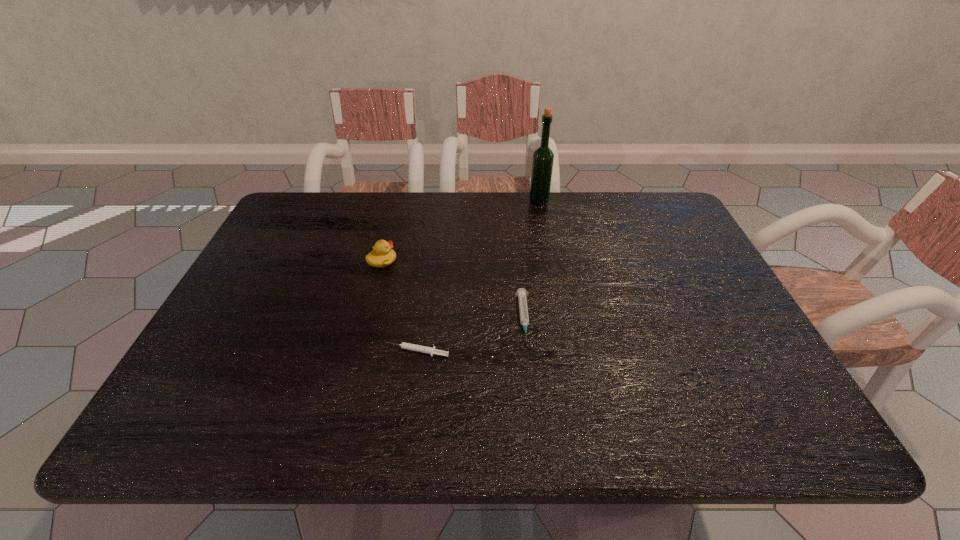
I want to click on the closest object relative to the shortest object, so tap(521, 293).

This screenshot has height=540, width=960. Find the location of `free space that satisfies the following two spatial constraints: 1. on the front side of the tallest object; 2. on the beak of the third nearest object`. free space that satisfies the following two spatial constraints: 1. on the front side of the tallest object; 2. on the beak of the third nearest object is located at coordinates (550, 261).

This screenshot has height=540, width=960. In order to click on free space that satisfies the following two spatial constraints: 1. on the beak of the shorter syringe; 2. on the left side of the third shortest object in this screenshot , I will do `click(359, 352)`.

Identify the location of free space that satisfies the following two spatial constraints: 1. on the front side of the tallest object; 2. on the beak of the duckling. The height and width of the screenshot is (540, 960). (550, 261).